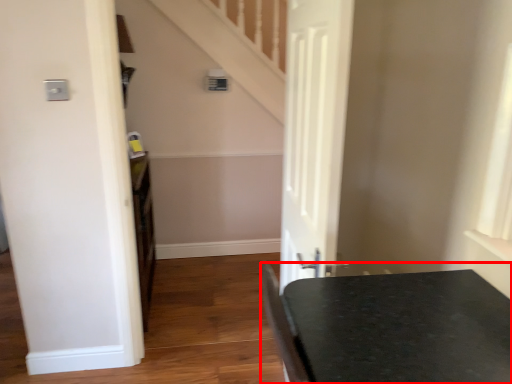
Question: Observing the image, what is the correct spatial positioning of table (annotated by the red box) in reference to door?

Choices:
 (A) right
 (B) left

Answer: (A)